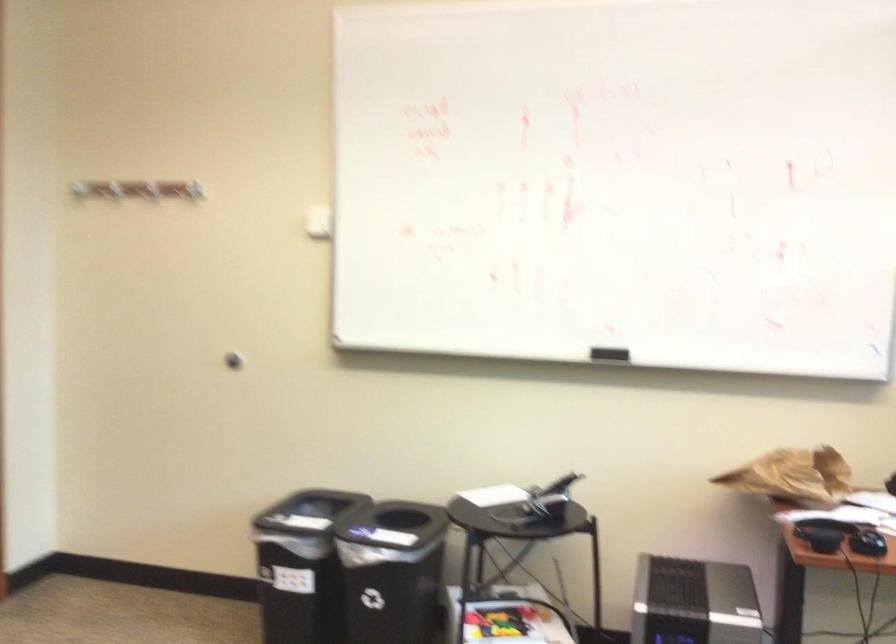
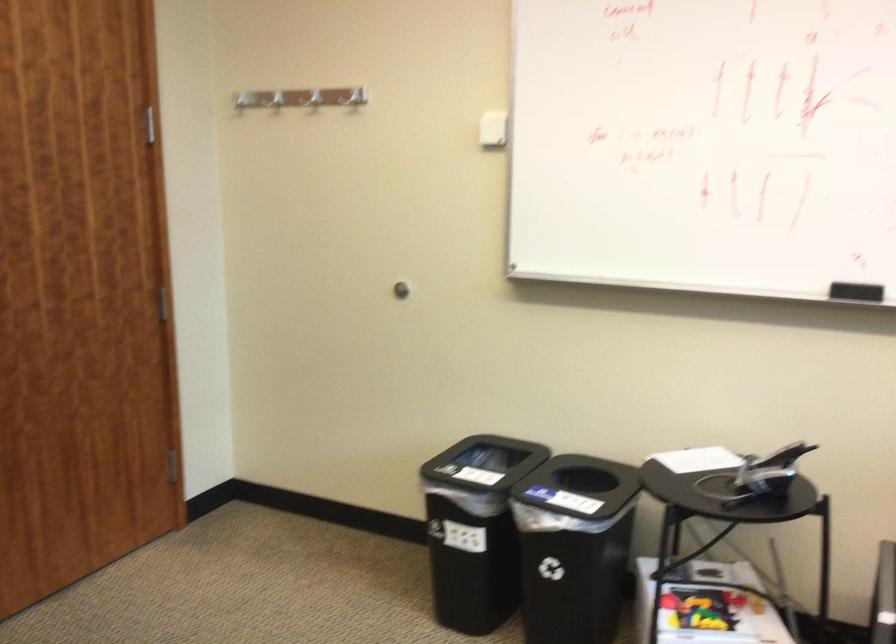
Find the pixel in the second image that matches the point at 191,184 in the first image.

(352, 97)